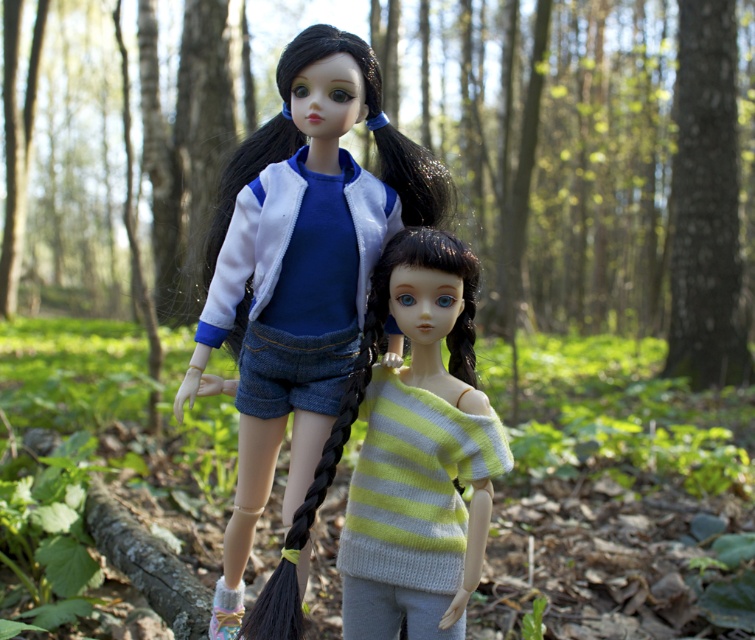
You are a photographer trying to capture a clear photo of the matte white jacket at center without the green leafy forest at center blocking it. How can you adjust your camera angle to achieve this?

The green leafy forest at center is taller than the matte white jacket at center, so you can lower your camera angle to position the matte white jacket at center below the forest, ensuring it is visible without obstruction.